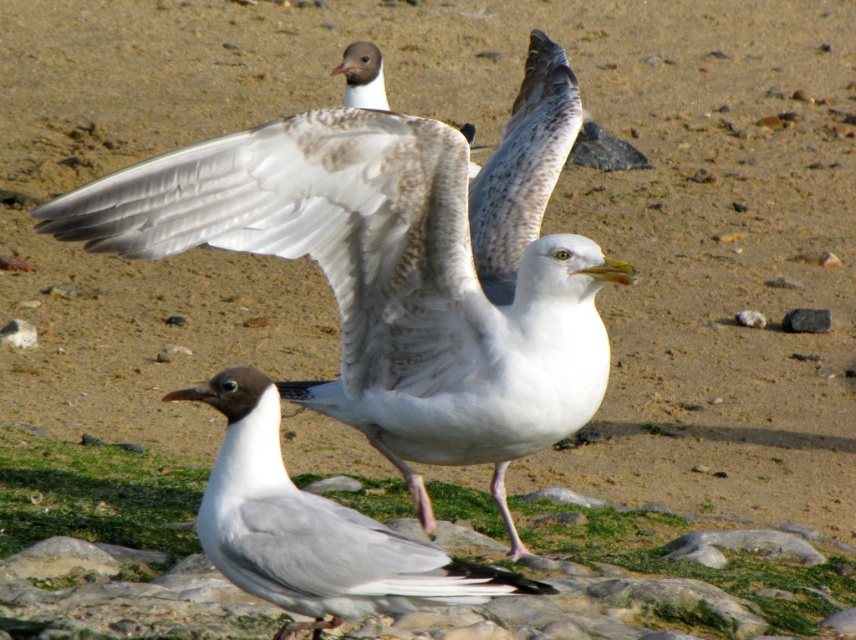
Question: Among these points, which one is nearest to the camera?

Choices:
 (A) (379, 262)
 (B) (357, 518)

Answer: (B)

Question: Does white feathered bird at center have a lesser width compared to gray matte seagull at center?

Choices:
 (A) yes
 (B) no

Answer: (B)

Question: Can you confirm if white feathered bird at center is positioned below gray matte seagull at center?

Choices:
 (A) yes
 (B) no

Answer: (B)

Question: Is white feathered bird at center wider than gray matte seagull at center?

Choices:
 (A) yes
 (B) no

Answer: (A)

Question: Which point appears farthest from the camera in this image?

Choices:
 (A) (391, 348)
 (B) (229, 424)

Answer: (A)